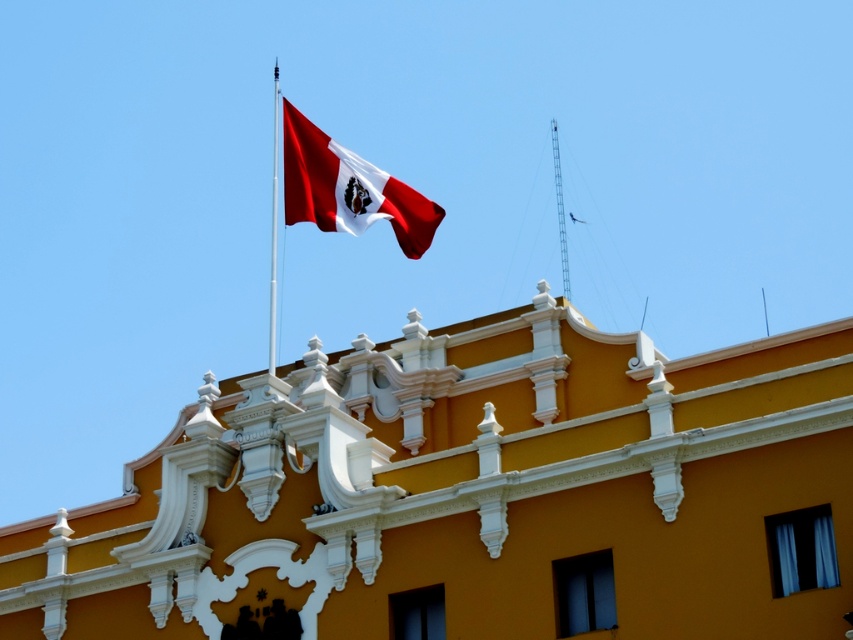
Question: Among these points, which one is nearest to the camera?

Choices:
 (A) (358, 358)
 (B) (566, 243)
 (C) (368, 186)
 (D) (271, 237)

Answer: (C)

Question: Can you confirm if matte red flag at upper center is positioned below metallic flag pole at upper center?

Choices:
 (A) no
 (B) yes

Answer: (A)

Question: Which object is positioned closest to the metallic tower at upper center?

Choices:
 (A) matte orange building at center
 (B) matte red flag at upper center
 (C) metallic flag pole at upper center

Answer: (C)

Question: Can you confirm if matte red flag at upper center is positioned above metallic tower at upper center?

Choices:
 (A) no
 (B) yes

Answer: (B)

Question: Estimate the real-world distances between objects in this image. Which object is farther from the matte orange building at center?

Choices:
 (A) matte red flag at upper center
 (B) metallic tower at upper center

Answer: (B)

Question: Does metallic flag pole at upper center have a smaller size compared to metallic tower at upper center?

Choices:
 (A) yes
 (B) no

Answer: (B)